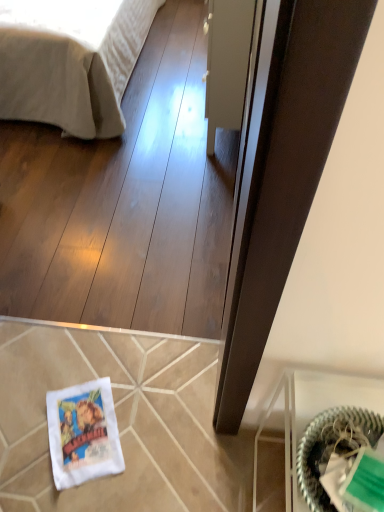
I want to click on free spot to the left of transparent glass door at center, so click(x=157, y=112).